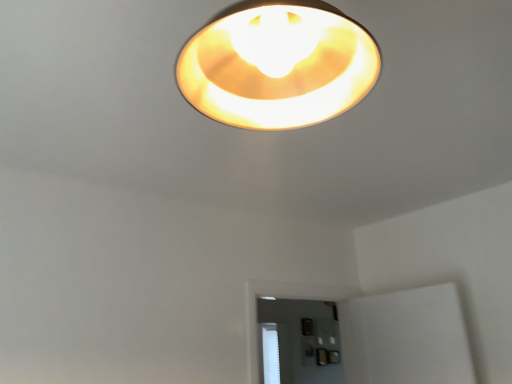
Image resolution: width=512 pixels, height=384 pixels. What do you see at coordinates (278, 65) in the screenshot? I see `matte yellow ring at upper center` at bounding box center [278, 65].

At what (x,y) coordinates should I click in order to perform the action: click on matte yellow ring at upper center. Please return your answer as a coordinate pair (x, y). The height and width of the screenshot is (384, 512). Looking at the image, I should click on (278, 65).

Where is `matte yellow ring at upper center`? matte yellow ring at upper center is located at coordinates (278, 65).